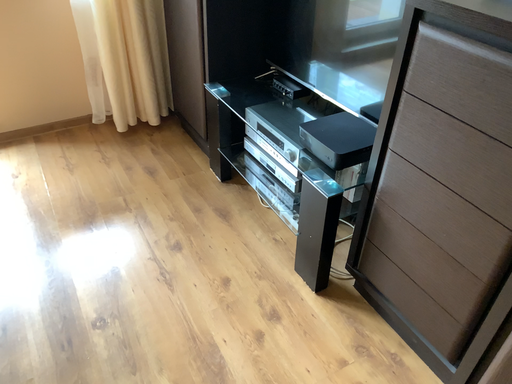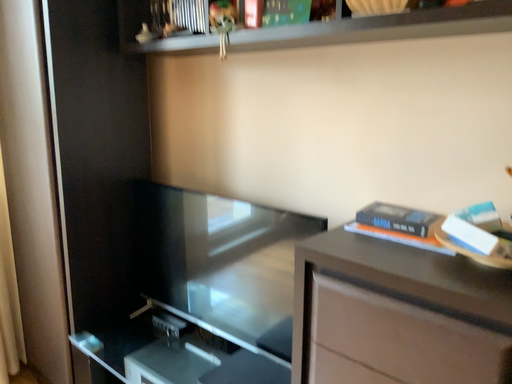
Question: How did the camera likely rotate when shooting the video?

Choices:
 (A) rotated upward
 (B) rotated downward

Answer: (A)